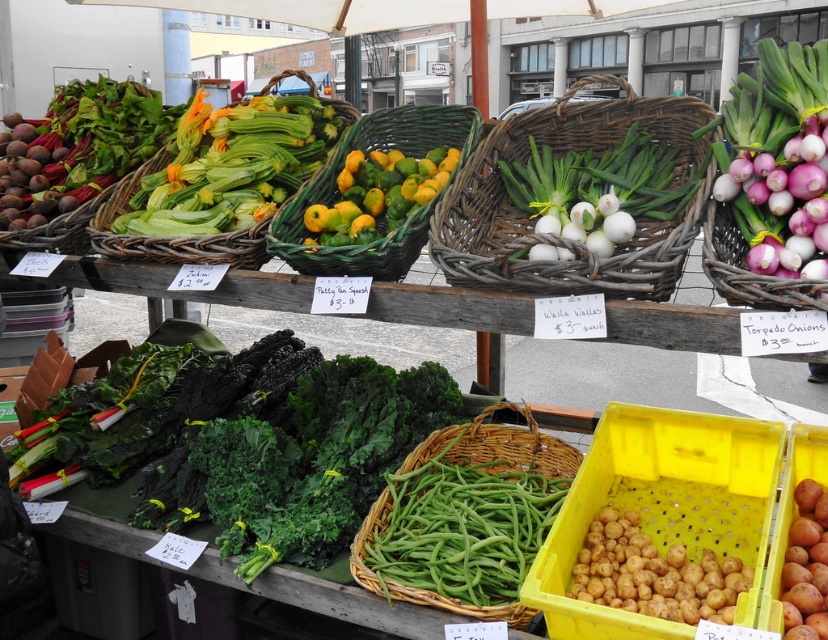
Does point (629, 518) come farther from viewer compared to point (128, 179)?

No, (629, 518) is in front of (128, 179).

Does yellow matte potatoes at lower right appear on the right side of green wicker basket at upper center?

Correct, you'll find yellow matte potatoes at lower right to the right of green wicker basket at upper center.

Between point (590, 552) and point (172, 237), which one is positioned behind?

The point (172, 237) is behind.

The height and width of the screenshot is (640, 828). Identify the location of yellow matte potatoes at lower right. (653, 573).

Which of these two, bright green leafy vegetables at left or green wicker basket at upper center, stands taller?

bright green leafy vegetables at left is taller.

Does bright green leafy vegetables at left have a greater height compared to green wicker basket at upper center?

Yes.

Is point (118, 83) farther from viewer compared to point (242, 234)?

Yes, it is behind point (242, 234).

Identify the location of bright green leafy vegetables at left. This screenshot has height=640, width=828. (78, 148).

Is white wicker basket at center smaller than green woven basket at center?

No, white wicker basket at center is not smaller than green woven basket at center.

Looking at this image, can you confirm if white wicker basket at center is wider than green woven basket at center?

Correct, the width of white wicker basket at center exceeds that of green woven basket at center.

Between point (663, 250) and point (448, 120), which one is positioned in front?

Point (663, 250)

Where is `white wicker basket at center`? The height and width of the screenshot is (640, 828). white wicker basket at center is located at coordinates (557, 236).